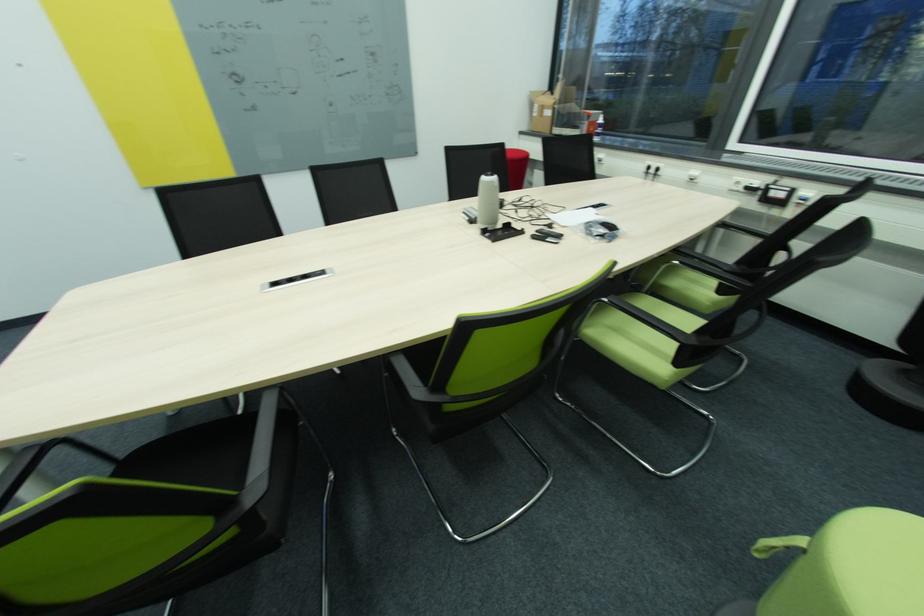
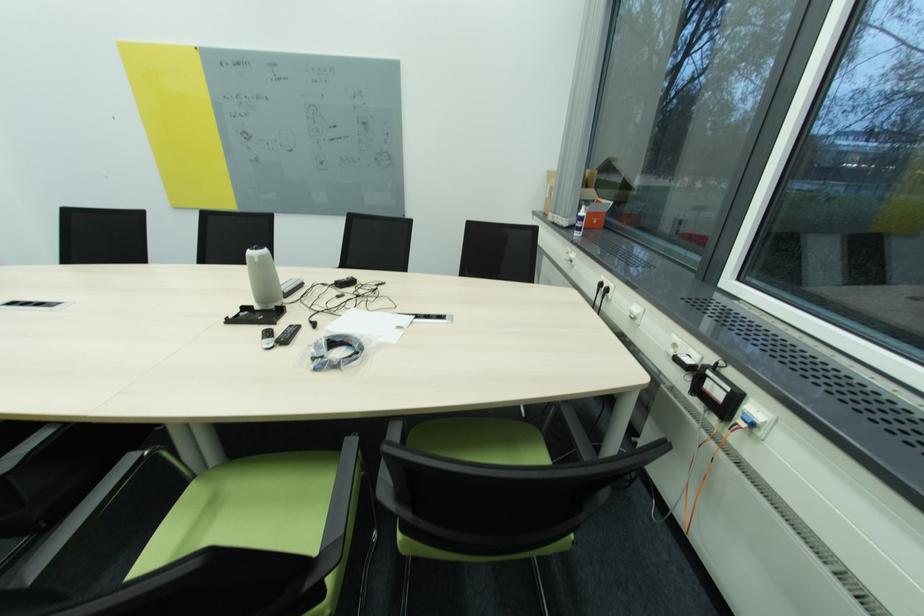
In the second image, find the point that corresponds to [743,184] in the first image.

(679, 346)